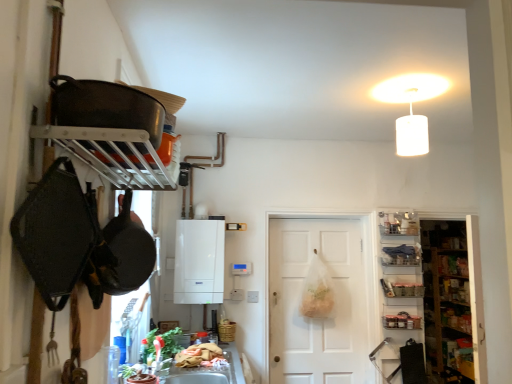
Question: Is metallic silver tray at right, the third shelf in the top-to-bottom sequence, inside metallic glass jars at right?

Choices:
 (A) no
 (B) yes

Answer: (A)

Question: From the image's perspective, would you say metallic glass jars at right is positioned over metallic silver tray at right, placed as the 1th shelf when sorted from bottom to top?

Choices:
 (A) no
 (B) yes

Answer: (A)

Question: Does metallic glass jars at right have a larger size compared to metallic silver tray at right, the third shelf in the top-to-bottom sequence?

Choices:
 (A) yes
 (B) no

Answer: (A)

Question: Is metallic glass jars at right at the left side of metallic silver tray at right, the third shelf in the top-to-bottom sequence?

Choices:
 (A) yes
 (B) no

Answer: (A)

Question: Is metallic glass jars at right beside metallic silver tray at right, placed as the 1th shelf when sorted from bottom to top?

Choices:
 (A) no
 (B) yes

Answer: (A)

Question: Is metallic glass jars at right taller or shorter than metallic silver tray at right, the third shelf in the top-to-bottom sequence?

Choices:
 (A) tall
 (B) short

Answer: (A)

Question: Relative to metallic silver tray at right, placed as the 1th shelf when sorted from bottom to top, is metallic glass jars at right in front or behind?

Choices:
 (A) behind
 (B) front

Answer: (B)

Question: Considering the positions of point 406,316 and point 403,296, is point 406,316 closer or farther from the camera than point 403,296?

Choices:
 (A) closer
 (B) farther

Answer: (A)

Question: Visually, is metallic glass jars at right positioned to the left or to the right of metallic silver tray at right, placed as the 1th shelf when sorted from bottom to top?

Choices:
 (A) right
 (B) left

Answer: (B)

Question: Does point (218, 329) appear closer or farther from the camera than point (397, 294)?

Choices:
 (A) closer
 (B) farther

Answer: (A)

Question: Considering the positions of wooden basket at lower center and metallic silver tray at right, the third shelf in the top-to-bottom sequence, in the image, is wooden basket at lower center bigger or smaller than metallic silver tray at right, the third shelf in the top-to-bottom sequence,?

Choices:
 (A) small
 (B) big

Answer: (A)

Question: From a real-world perspective, is wooden basket at lower center above or below metallic silver tray at right, placed as the 1th shelf when sorted from bottom to top?

Choices:
 (A) below
 (B) above

Answer: (A)

Question: From the image's perspective, is wooden basket at lower center positioned above or below metallic silver tray at right, the third shelf in the top-to-bottom sequence?

Choices:
 (A) below
 (B) above

Answer: (A)

Question: Which is correct: metallic glass jars at right is inside metallic silver shelf at upper right, arranged as the 1th shelf when viewed from the top, or outside of it?

Choices:
 (A) inside
 (B) outside

Answer: (B)

Question: From the image's perspective, is metallic glass jars at right positioned above or below metallic silver shelf at upper right, arranged as the 1th shelf when viewed from the top?

Choices:
 (A) below
 (B) above

Answer: (A)